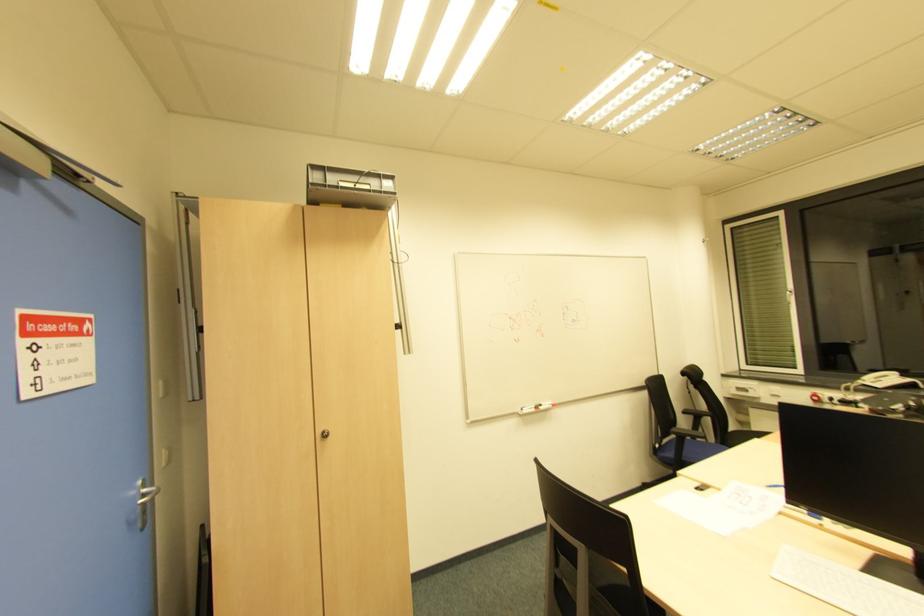
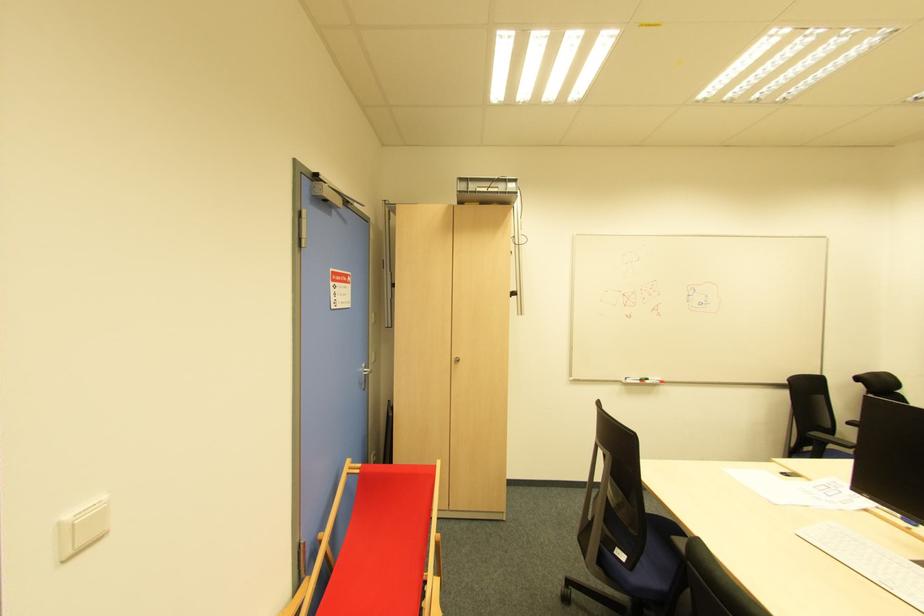
Find the pixel in the second image that matches [323,437] in the first image.

(457, 362)